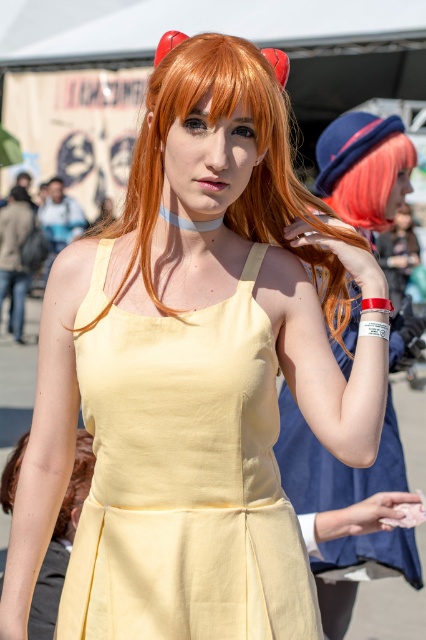
Based on the photo, between yellow fabric dress at center and matte yellow dress at center, which one has less height?

matte yellow dress at center

Between point (313, 484) and point (57, 570), which one is positioned in front?

Point (57, 570) is in front.

The image size is (426, 640). What are the coordinates of `yellow fabric dress at center` in the screenshot? It's located at (333, 464).

Is shiny orange hair at center shorter than shiny pink wig at upper right?

No.

Between point (267, 196) and point (370, 161), which one is positioned behind?

The point (370, 161) is behind.

You are a GUI agent. You are given a task and a screenshot of the screen. Output one action in this format:
    pyautogui.click(x=<x>, y=<y>)
    Task: Click on the shiny orange hair at center
    
    Given the screenshot: What is the action you would take?
    pyautogui.click(x=252, y=170)

Is linen yellow dress at center behind matte yellow dress at center?

No, linen yellow dress at center is in front of matte yellow dress at center.

Does point (126, 385) come closer to viewer compared to point (55, 548)?

Yes, point (126, 385) is closer to viewer.

Locate an element on the screen. The height and width of the screenshot is (640, 426). linen yellow dress at center is located at coordinates (186, 483).